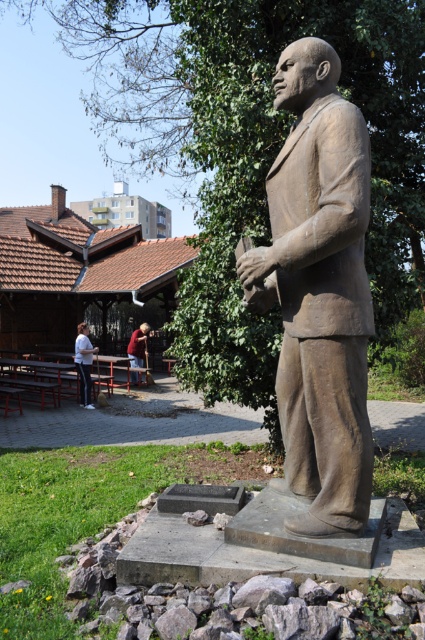
Question: Observing the image, what is the correct spatial positioning of white matte shirt at lower left in reference to red shirt at lower left?

Choices:
 (A) left
 (B) right

Answer: (A)

Question: Which point appears farthest from the camera in this image?

Choices:
 (A) (297, 61)
 (B) (138, 339)

Answer: (B)

Question: Is bronze statue at center to the left of white matte shirt at lower left from the viewer's perspective?

Choices:
 (A) no
 (B) yes

Answer: (A)

Question: Is white matte shirt at lower left thinner than red shirt at lower left?

Choices:
 (A) no
 (B) yes

Answer: (A)

Question: Which object is positioned farthest from the bronze statue at center?

Choices:
 (A) white matte shirt at lower left
 (B) red shirt at lower left

Answer: (B)

Question: Which point is farther to the camera?

Choices:
 (A) (136, 330)
 (B) (87, 376)

Answer: (A)